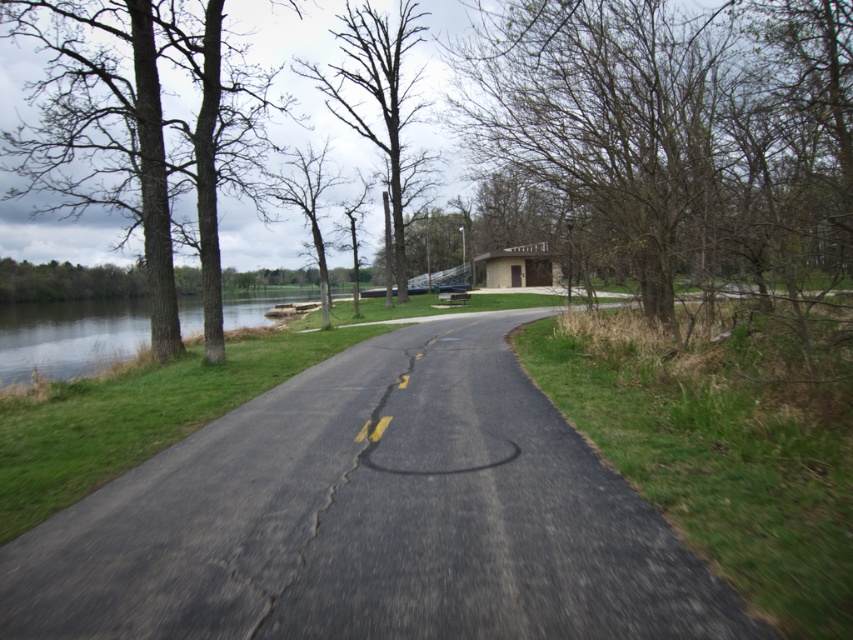
Question: Observing the image, what is the correct spatial positioning of brown rough tree at left in reference to bare wood tree at center?

Choices:
 (A) left
 (B) right

Answer: (A)

Question: Can you confirm if asphalt road at center is smaller than brown leafless tree at upper right?

Choices:
 (A) yes
 (B) no

Answer: (A)

Question: Is asphalt road at center to the left of bare wood tree at center from the viewer's perspective?

Choices:
 (A) no
 (B) yes

Answer: (A)

Question: Which point is farther to the camera?

Choices:
 (A) brown leafless tree at upper right
 (B) brown rough tree at left

Answer: (B)

Question: Which object appears closest to the camera in this image?

Choices:
 (A) brown rough tree at left
 (B) bare wood tree at center

Answer: (A)

Question: Which point appears farthest from the camera in this image?

Choices:
 (A) (556, 150)
 (B) (352, 28)
 (C) (136, 140)

Answer: (B)